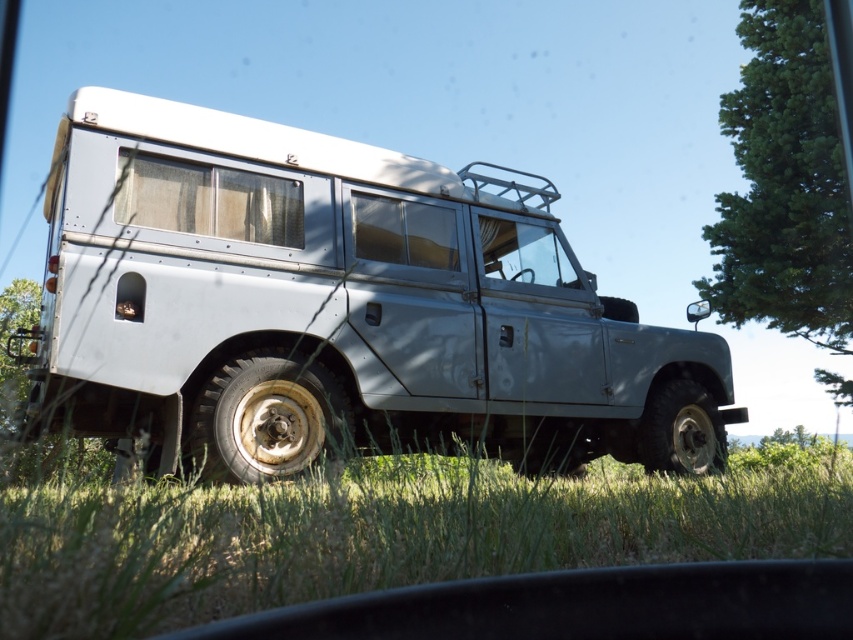
Question: Does silver metallic suv at center appear under green leafy tree at upper right?

Choices:
 (A) no
 (B) yes

Answer: (B)

Question: Among these objects, which one is nearest to the camera?

Choices:
 (A) silver metallic suv at center
 (B) green leafy tree at upper right

Answer: (A)

Question: Which object is farther from the camera taking this photo?

Choices:
 (A) silver metallic suv at center
 (B) green leafy tree at upper right

Answer: (B)

Question: Is silver metallic suv at center smaller than green leafy tree at upper right?

Choices:
 (A) yes
 (B) no

Answer: (B)

Question: Can you confirm if silver metallic suv at center is thinner than green leafy tree at upper right?

Choices:
 (A) no
 (B) yes

Answer: (A)